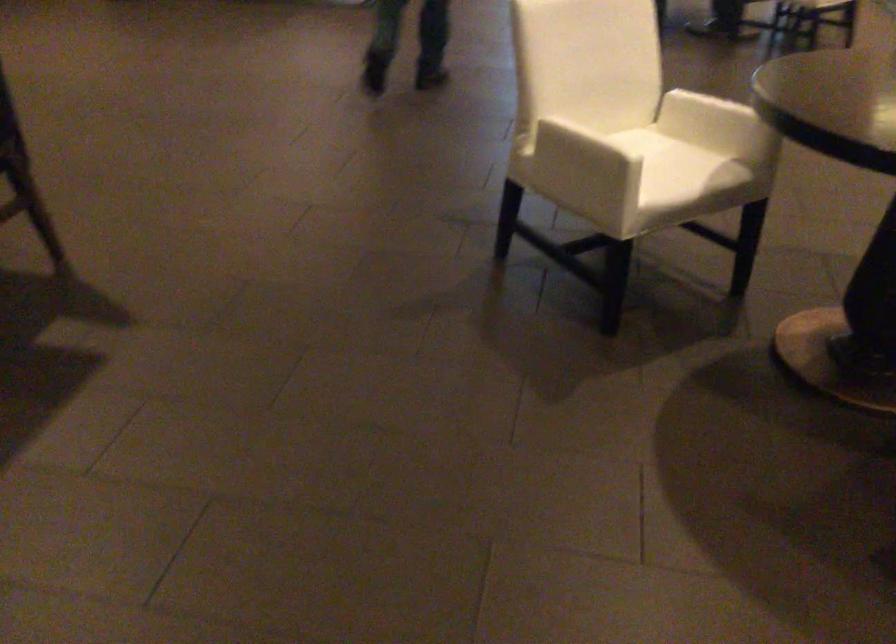
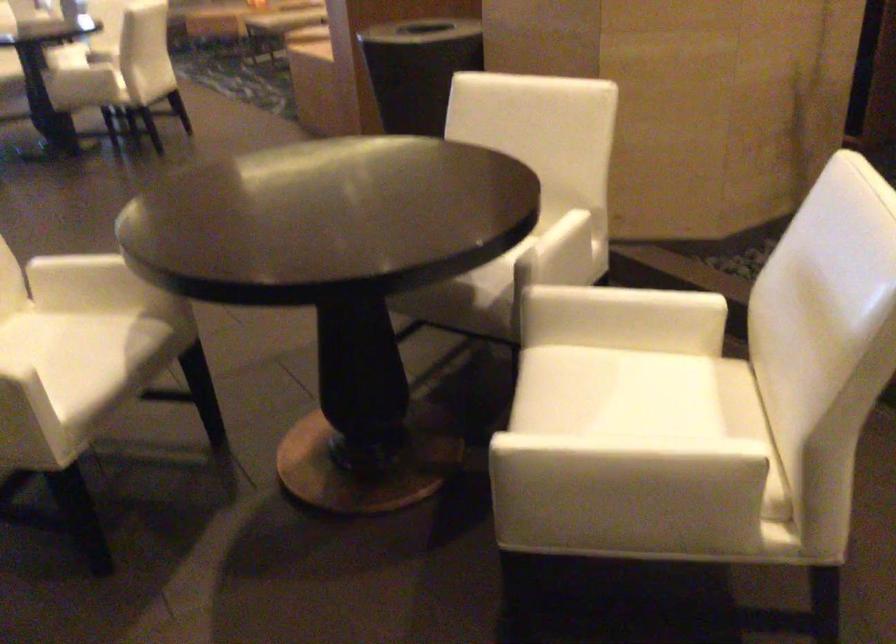
Find the pixel in the second image that matches (x=668, y=151) in the first image.

(67, 336)